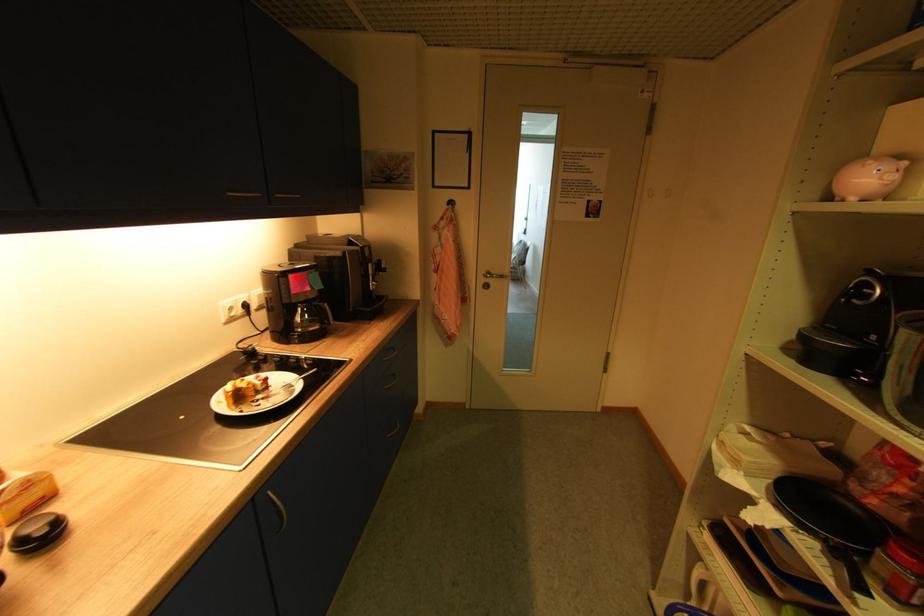
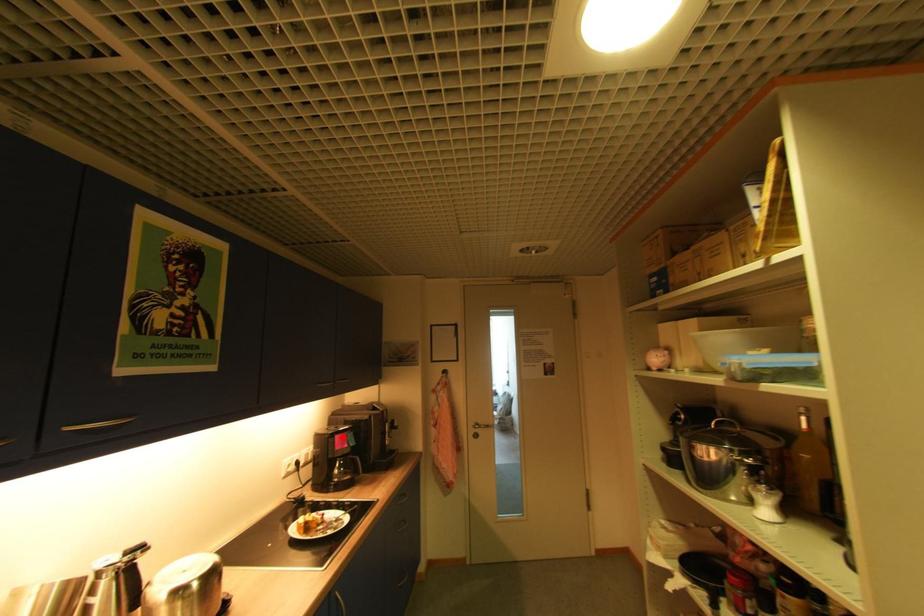
I am providing you with two images of the same scene from different viewpoints. A red point is marked on the first image and another point is marked on the second image. Is the marked point in image1 the same physical position as the marked point in image2?

Yes